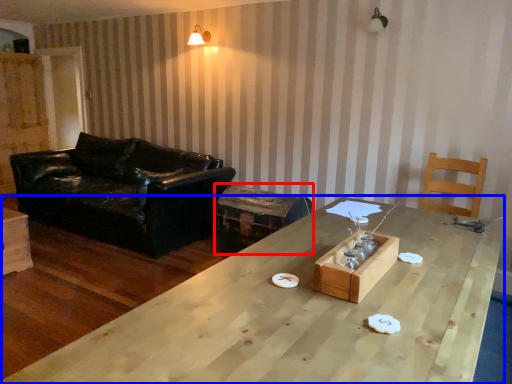
Question: Which object appears closest to the camera in this image, swivel chair (highlighted by a red box) or table (highlighted by a blue box)?

Choices:
 (A) swivel chair
 (B) table

Answer: (B)